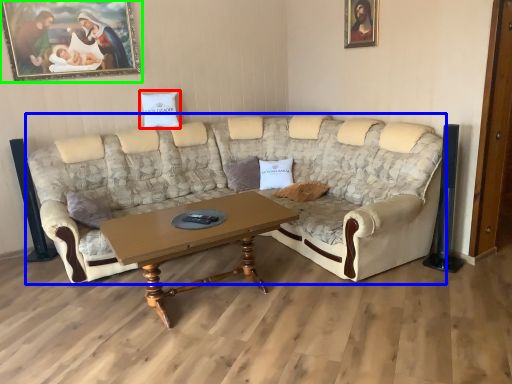
Question: Which is farther away from pillow (highlighted by a red box)? studio couch (highlighted by a blue box) or picture frame (highlighted by a green box)?

Choices:
 (A) studio couch
 (B) picture frame

Answer: (A)